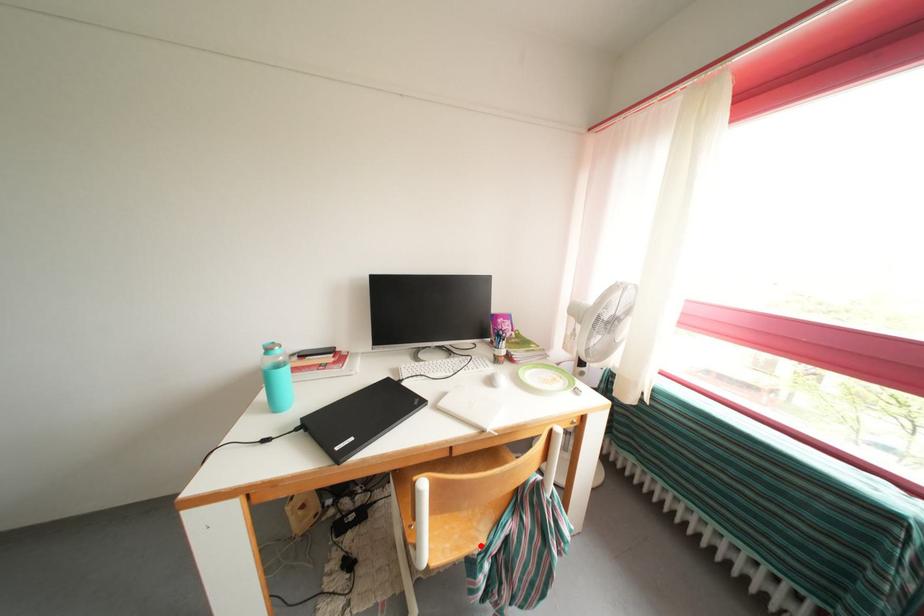
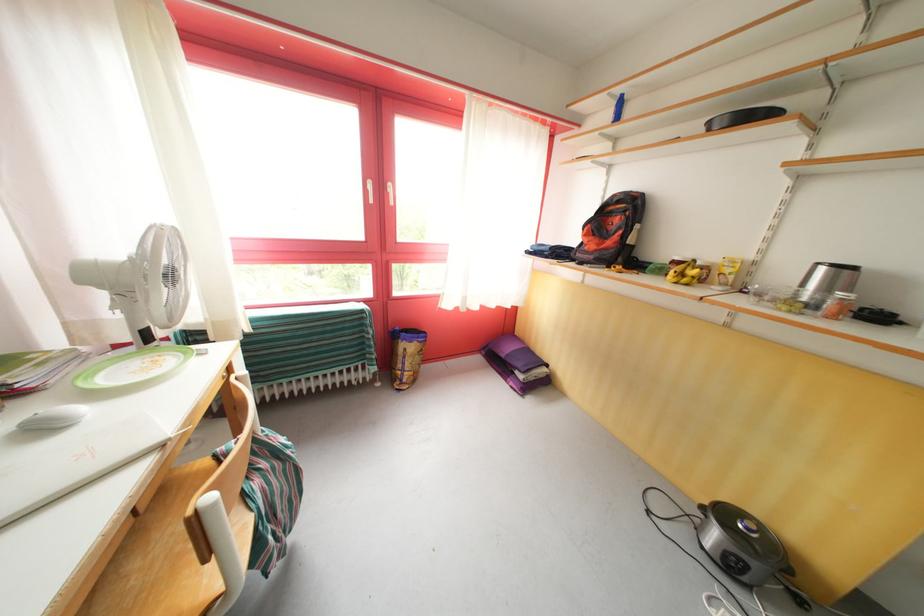
Where in the second image is the point corresponding to the highlighted location from the first image?

(251, 535)